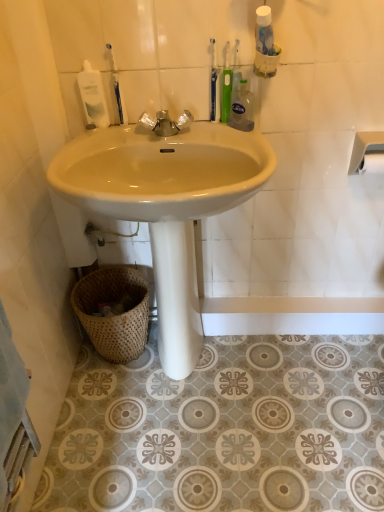
Where is `vacant space that is to the left of blue plastic toothbrush at upper center, which is the second toothbrush from left to right`? The height and width of the screenshot is (512, 384). vacant space that is to the left of blue plastic toothbrush at upper center, which is the second toothbrush from left to right is located at coordinates click(167, 133).